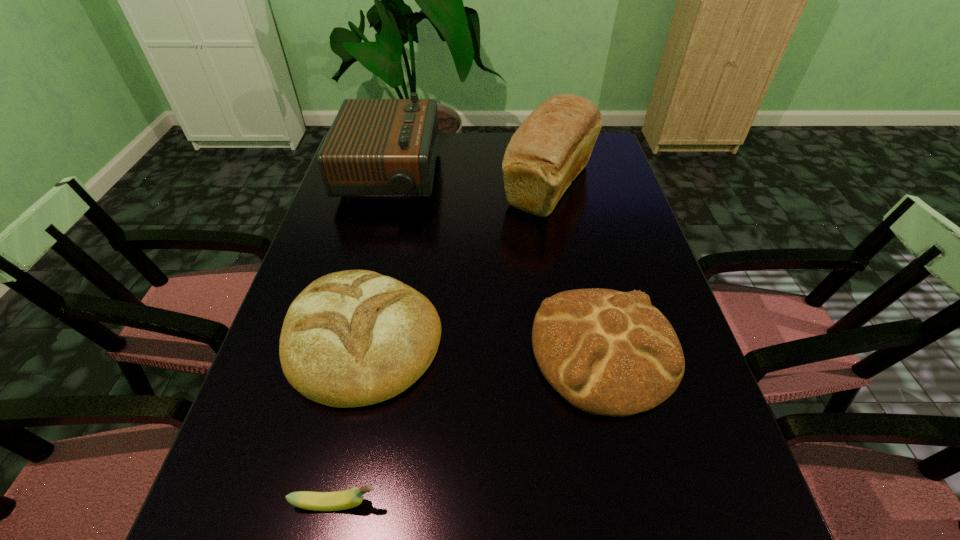
I want to click on bread that is at the far edge, so click(551, 147).

At what (x,y) coordinates should I click in order to perform the action: click on radio receiver that is at the far edge. Please return your answer as a coordinate pair (x, y). Looking at the image, I should click on (376, 148).

Where is `radio receiver that is at the left edge`? radio receiver that is at the left edge is located at coordinates 376,148.

You are a GUI agent. You are given a task and a screenshot of the screen. Output one action in this format:
    pyautogui.click(x=<x>, y=<y>)
    Task: Click on the bread that is positioned at the left edge
    This screenshot has height=540, width=960.
    Given the screenshot: What is the action you would take?
    pyautogui.click(x=352, y=338)

This screenshot has height=540, width=960. In order to click on banana present at the left edge in this screenshot , I will do `click(340, 500)`.

Where is `object that is at the far left corner`? object that is at the far left corner is located at coordinates (376, 148).

Find the location of `object present at the far right corner`. object present at the far right corner is located at coordinates (551, 147).

At what (x,y) coordinates should I click in order to perform the action: click on free point at the left edge. Please return your answer as a coordinate pair (x, y). This screenshot has width=960, height=540. Looking at the image, I should click on (377, 221).

In the image, there is a desktop. Where is `free region at the right edge`? Image resolution: width=960 pixels, height=540 pixels. free region at the right edge is located at coordinates (673, 327).

I want to click on vacant space at the far right corner of the desktop, so click(604, 138).